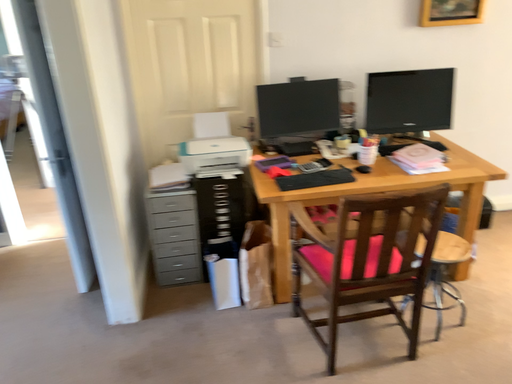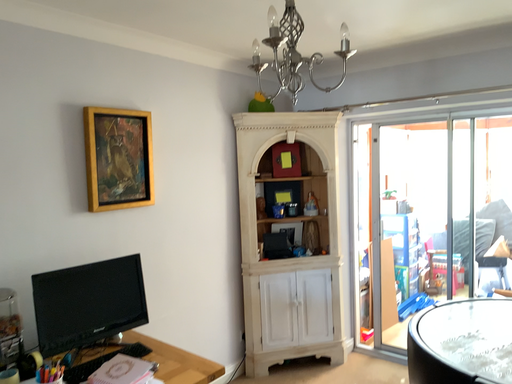
Question: Which way did the camera rotate in the video?

Choices:
 (A) rotated right
 (B) rotated left

Answer: (A)